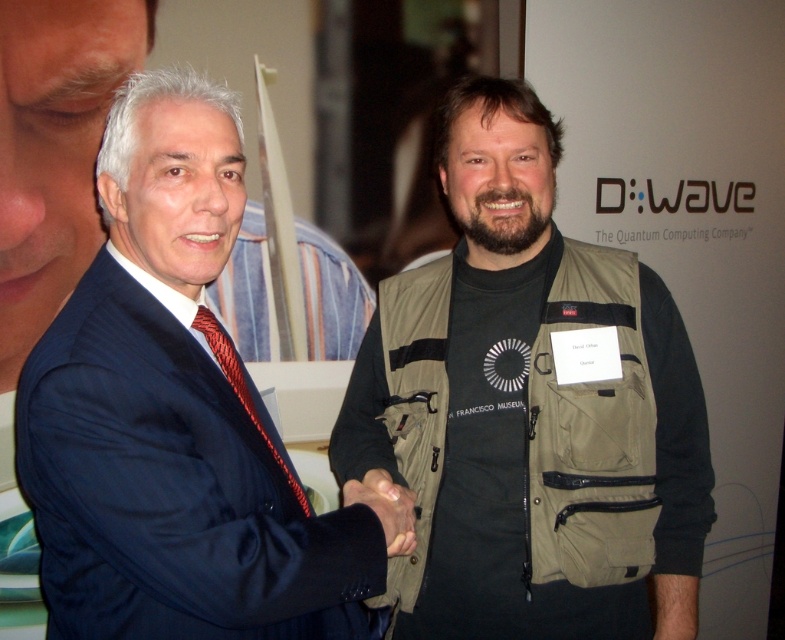
You are standing at the entrance of the conference hall and see the scene described. There is a point marked at coordinates (174,416). What object is located at that point?

The point at coordinates (174,416) corresponds to the matte blue suit at center.

Based on the photo, you are an event photographer at the D Wave conference. You need to capture a clear photo of the matte blue suit at center and the khaki fabric vest at center. Since the people are moving, you want to know which one is closer to the camera so you can prioritize focusing on it. Based on the scene description, which person is closer to the camera?

The khaki fabric vest at center is closer to the camera because the matte blue suit at center is behind it.

You are a photographer at the event and want to capture a closeup shot of the banner in the background. To do this, you need to adjust your camera focus to ensure both the banner and the hands of the individuals shaking hands are in focus. Given the current setup, will the matte blue suit at center and the smooth skin hand at center be in focus at the same time?

The matte blue suit at center is bigger than the smooth skin hand at center, so their sizes differ significantly. However, focus in photography depends on distance from the lens and depth of field. Since both are at the same distance from the camera at center, they should be in focus simultaneously if the depth of field is sufficient. Adjust the aperture to a smaller opening for a greater depth of field to ensure both are sharp.